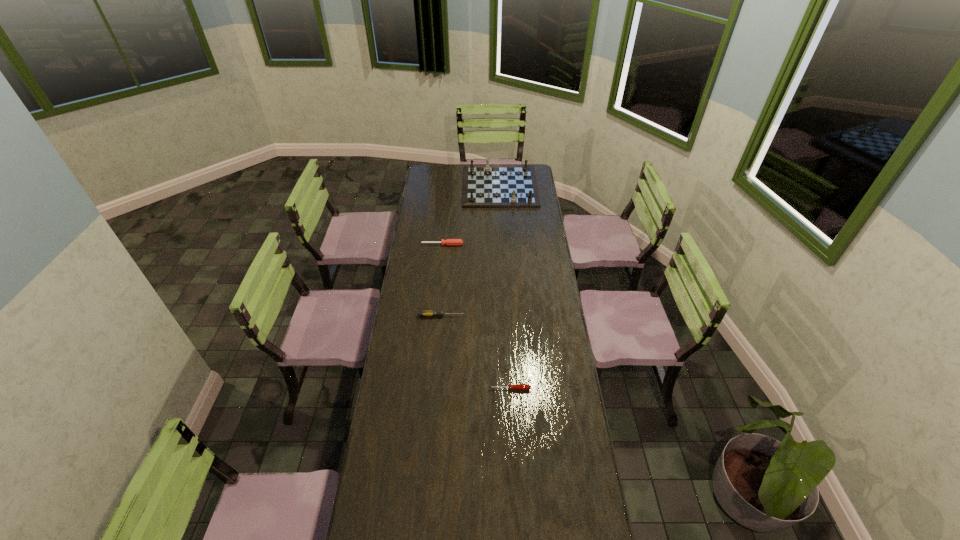
This screenshot has height=540, width=960. I want to click on object that is at the far edge, so click(484, 186).

Locate an element on the screen. The image size is (960, 540). object located in the right edge section of the desktop is located at coordinates (484, 186).

At what (x,y) coordinates should I click in order to perform the action: click on object positioned at the far right corner. Please return your answer as a coordinate pair (x, y). Looking at the image, I should click on (x=484, y=186).

I want to click on blank space at the far edge of the desktop, so click(456, 174).

In the image, there is a desktop. At what (x,y) coordinates should I click in order to perform the action: click on vacant space at the left edge. Please return your answer as a coordinate pair (x, y). The image size is (960, 540). Looking at the image, I should click on (418, 200).

Locate an element on the screen. This screenshot has width=960, height=540. vacant space at the right edge of the desktop is located at coordinates (546, 265).

You are a GUI agent. You are given a task and a screenshot of the screen. Output one action in this format:
    pyautogui.click(x=<x>, y=<y>)
    Task: Click on the vacant space at the far left corner of the desktop
    Image resolution: width=960 pixels, height=540 pixels.
    Given the screenshot: What is the action you would take?
    pyautogui.click(x=441, y=179)

You are a GUI agent. You are given a task and a screenshot of the screen. Output one action in this format:
    pyautogui.click(x=<x>, y=<y>)
    Task: Click on the free spot between the third nearest object and the nearest screwdriver
    This screenshot has height=540, width=960.
    Given the screenshot: What is the action you would take?
    pyautogui.click(x=476, y=316)

You are a GUI agent. You are given a task and a screenshot of the screen. Output one action in this format:
    pyautogui.click(x=<x>, y=<y>)
    Task: Click on the vacant space that is in between the second farthest screwdriver and the third nearest object
    
    Given the screenshot: What is the action you would take?
    pyautogui.click(x=442, y=280)

You are a GUI agent. You are given a task and a screenshot of the screen. Output one action in this format:
    pyautogui.click(x=<x>, y=<y>)
    Task: Click on the free point between the tallest object and the second farthest object
    
    Given the screenshot: What is the action you would take?
    pyautogui.click(x=471, y=215)